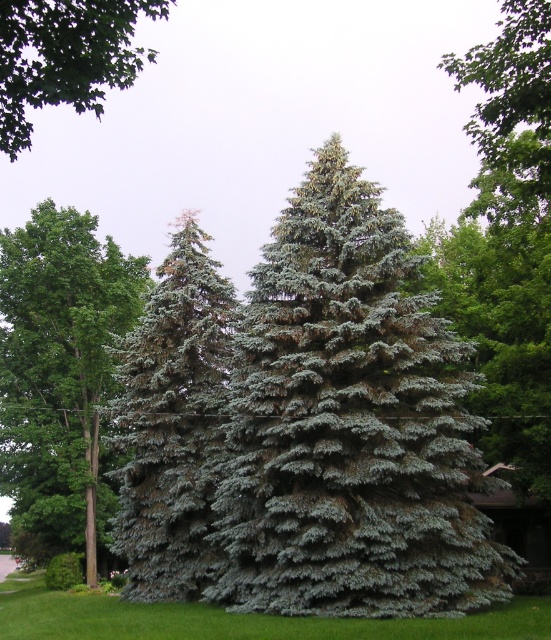
Does point (68, 250) lie behind point (199, 608)?

Yes, it is.

This screenshot has height=640, width=551. What do you see at coordinates (60, 371) in the screenshot? I see `green leafy tree at center` at bounding box center [60, 371].

This screenshot has width=551, height=640. I want to click on green leafy tree at center, so (60, 371).

Does green leafy tree at center appear on the right side of blue-green needle-like fir tree at center?

No, green leafy tree at center is not to the right of blue-green needle-like fir tree at center.

Can you confirm if green leafy tree at center is positioned below blue-green needle-like fir tree at center?

No, green leafy tree at center is not below blue-green needle-like fir tree at center.

Does point (96, 413) lie in front of point (126, 397)?

That is False.

In order to click on green leafy tree at center in this screenshot , I will do `click(60, 371)`.

Can you confirm if green leafy tree at center is bigger than green leafy branch at upper left?

Actually, green leafy tree at center might be smaller than green leafy branch at upper left.

Which is behind, point (83, 221) or point (42, 35)?

The point (83, 221) is behind.

Is point (79, 216) positioned in front of point (18, 24)?

No.

At what (x,y) coordinates should I click in order to perform the action: click on green leafy tree at center. Please return your answer as a coordinate pair (x, y). Looking at the image, I should click on (60, 371).